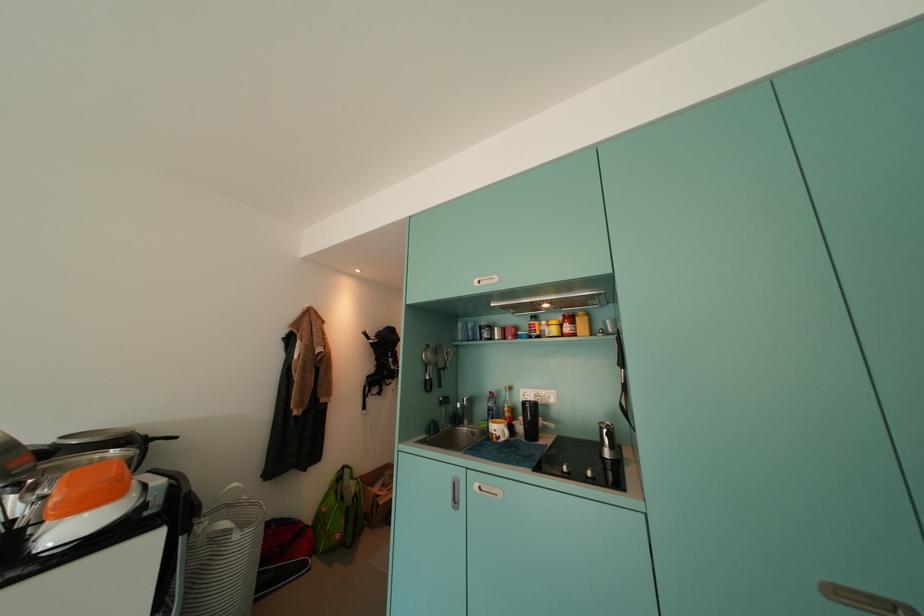
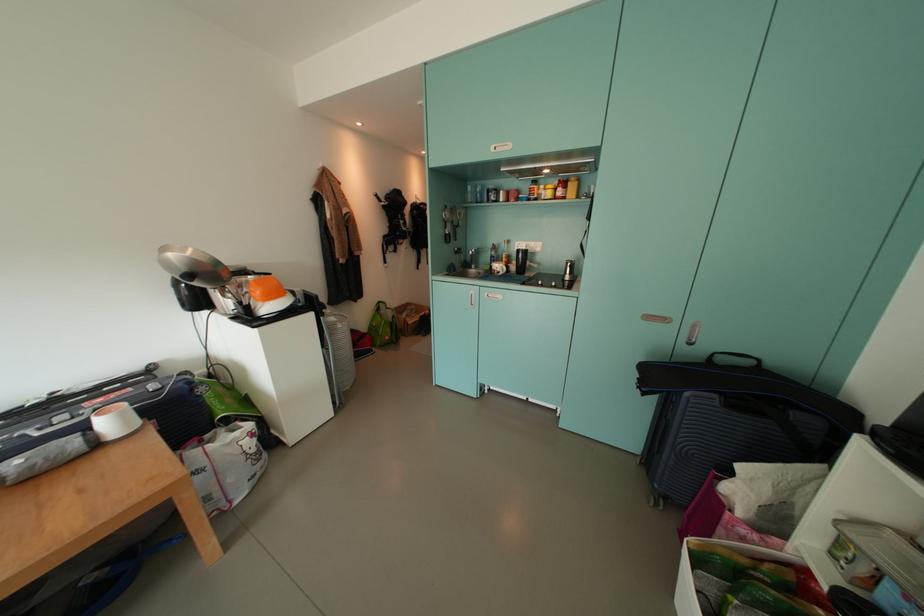
Locate, in the second image, the point that corresponds to point (575, 331) in the first image.

(566, 195)